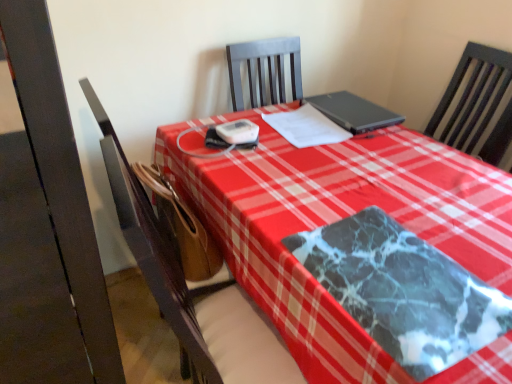
Question: Does white paper at center have a greater width compared to brown leather chair at center?

Choices:
 (A) no
 (B) yes

Answer: (A)

Question: Considering the relative positions of white paper at center and brown leather chair at center in the image provided, is white paper at center to the right of brown leather chair at center from the viewer's perspective?

Choices:
 (A) no
 (B) yes

Answer: (B)

Question: Does white paper at center have a smaller size compared to brown leather chair at center?

Choices:
 (A) yes
 (B) no

Answer: (A)

Question: From the image's perspective, is white paper at center below brown leather chair at center?

Choices:
 (A) no
 (B) yes

Answer: (A)

Question: From the image's perspective, is white paper at center located above brown leather chair at center?

Choices:
 (A) no
 (B) yes

Answer: (B)

Question: Does white paper at center have a lesser height compared to brown leather chair at center?

Choices:
 (A) yes
 (B) no

Answer: (A)

Question: From the image's perspective, is brown leather chair at center below white paper at center?

Choices:
 (A) yes
 (B) no

Answer: (A)

Question: Could you tell me if brown leather chair at center is turned towards white paper at center?

Choices:
 (A) no
 (B) yes

Answer: (B)

Question: Is brown leather chair at center to the left of white paper at center from the viewer's perspective?

Choices:
 (A) no
 (B) yes

Answer: (B)

Question: Does brown leather chair at center have a lesser height compared to white paper at center?

Choices:
 (A) no
 (B) yes

Answer: (A)

Question: From a real-world perspective, is brown leather chair at center located beneath white paper at center?

Choices:
 (A) no
 (B) yes

Answer: (B)

Question: Is brown leather chair at center at the right side of white paper at center?

Choices:
 (A) yes
 (B) no

Answer: (B)

Question: Does brown leather chair at center have a larger size compared to marble-patterned blanket at center?

Choices:
 (A) yes
 (B) no

Answer: (A)